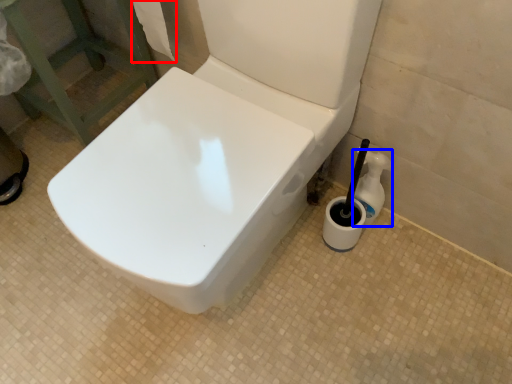
Question: Which object appears closest to the camera in this image, toilet paper (highlighted by a red box) or cleaning product (highlighted by a blue box)?

Choices:
 (A) toilet paper
 (B) cleaning product

Answer: (A)